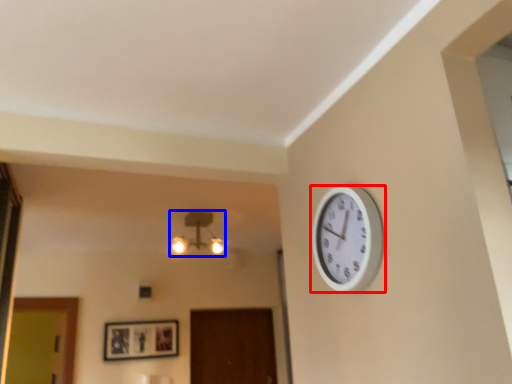
Question: Which point is further to the camera, wall clock (highlighted by a red box) or lamp (highlighted by a blue box)?

Choices:
 (A) wall clock
 (B) lamp

Answer: (B)